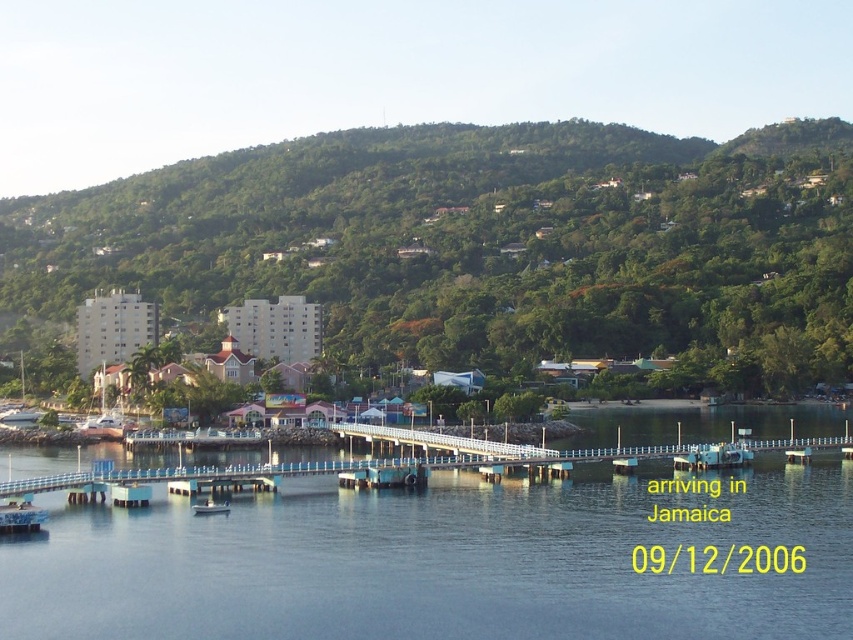
You are a photographer planning to capture the green leafy hillside at upper center and the white plastic boat at lower center in a single shot. Which object will appear larger in the photo?

The green leafy hillside at upper center will appear larger in the photo because it has a greater height compared to the white plastic boat at lower center.

You are standing at the point marked by the coordinates point (476, 241) in the image of a coastal area in Jamaica. What type of terrain would you be standing on?

The point (476, 241) corresponds to the green leafy hillside at upper center, so you would be standing on a hillside covered in dense vegetation typical of a tropical environment.

You are a tourist in Jamaica and want to take a photo of both the green leafy hillside at upper center and the white plastic boat at lower center. Based on their positions, which object should you frame first in your camera viewfinder to ensure both are in the shot?

The green leafy hillside at upper center is positioned on the right side of the white plastic boat at lower center, so you should frame the white plastic boat at lower center first and then adjust to include the green leafy hillside at upper center on the right side.